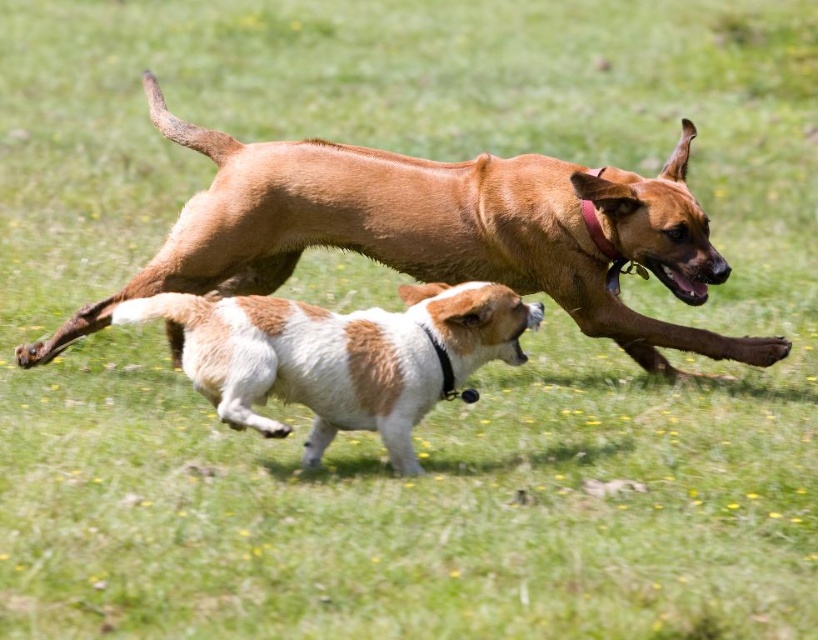
Which is more to the right, brown smooth dog at center or white-brown fur dog at center?

brown smooth dog at center is more to the right.

Who is higher up, brown smooth dog at center or white-brown fur dog at center?

Positioned higher is brown smooth dog at center.

Locate an element on the screen. brown smooth dog at center is located at coordinates (437, 232).